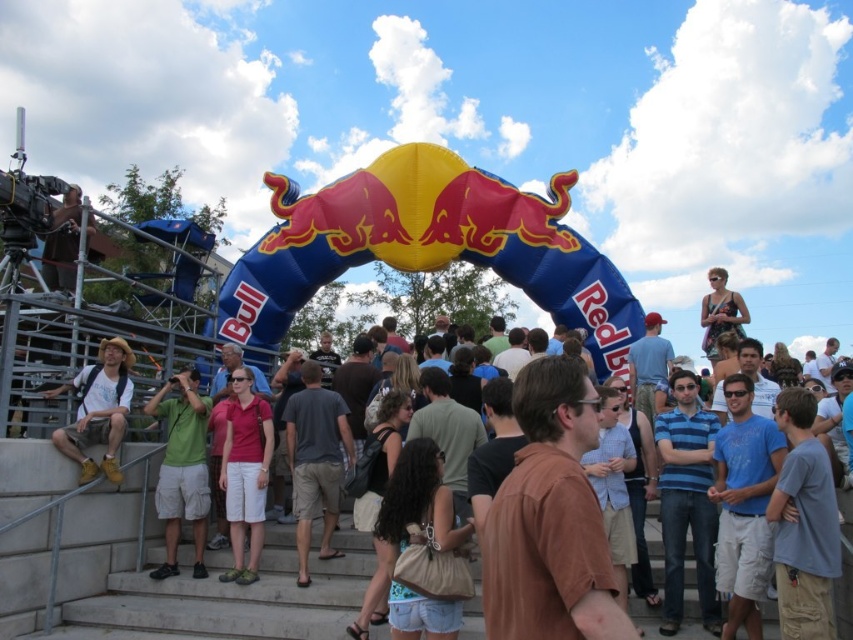
You are attending an outdoor event and want to take a photo of the light brown leather jacket at center without including the green cotton shirt at lower left in the frame. Which direction should you move your camera to the right or left?

Move your camera to the right. The green cotton shirt at lower left is to the left of the light brown leather jacket at center, so moving the camera to the right will exclude the green cotton shirt at lower left while keeping the light brown leather jacket at center in view.

You are at an event and want to take a photo of the matte pink shirt at center without anyone blocking it. Is the blue cotton shirt at center blocking your view?

The blue cotton shirt at center is in front of matte pink shirt at center, so it is blocking the view of the matte pink shirt at center.

You are a photographer at the event and need to capture a clear shot of both the blue cotton shirt at center and the dark brown leather jacket at center. Which clothing item should you focus on first to ensure it appears taller in the photo?

The blue cotton shirt at center has a greater height compared to the dark brown leather jacket at center, so you should focus on the blue cotton shirt at center first to ensure it appears taller in the photo.